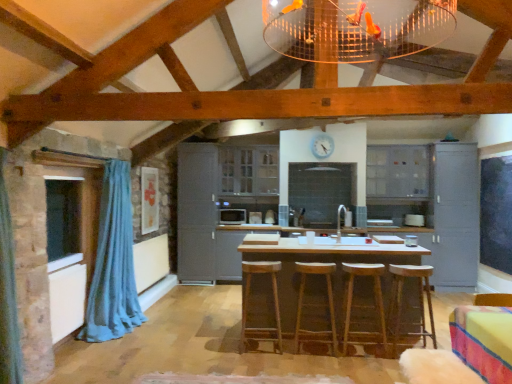
The height and width of the screenshot is (384, 512). I want to click on vacant area situated below wooden bar stool at center, the 2th bar stool from the right (from a real-world perspective), so click(x=361, y=352).